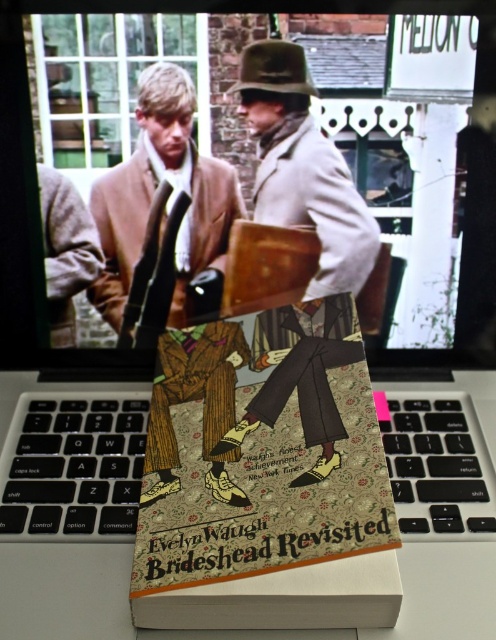
Measure the distance between patterned paper book at center and camera.

patterned paper book at center and camera are 52.91 centimeters apart.

Find the location of `patterned paper book at center`. patterned paper book at center is located at coordinates (285, 598).

You are a GUI agent. You are given a task and a screenshot of the screen. Output one action in this format:
    pyautogui.click(x=<x>, y=<y>)
    Task: Click on the patterned paper book at center
    This screenshot has width=496, height=640.
    Given the screenshot: What is the action you would take?
    pyautogui.click(x=285, y=598)

Locate an element on the screen. Image resolution: width=496 pixels, height=640 pixels. patterned paper book at center is located at coordinates (285, 598).

Identify the location of matte brown coat at center. Image resolution: width=496 pixels, height=640 pixels. (152, 196).

Who is more distant from viewer, (127, 282) or (164, 467)?

The point (127, 282) is more distant.

Identify the location of matte brown coat at center. (152, 196).

Which is in front, point (333, 205) or point (174, 342)?

Point (174, 342) is in front.

From the picture: Can you confirm if light beige wool coat at center is taller than wooden figure at center?

Yes, light beige wool coat at center is taller than wooden figure at center.

Which is in front, point (328, 256) or point (186, 328)?

Positioned in front is point (186, 328).

At what (x,y) coordinates should I click in order to perform the action: click on light beige wool coat at center. Please return your answer as a coordinate pair (x, y). The image size is (496, 640). Looking at the image, I should click on (307, 176).